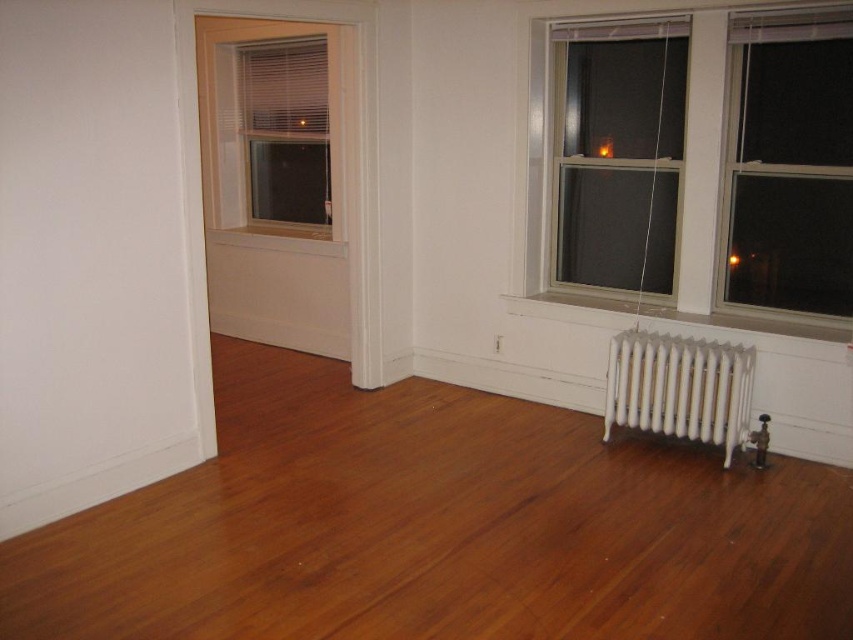
You are an interior designer planning to install a new decorative shelf between the transparent glass window at right and the transparent glass window at upper right. Since the shelf requires a certain amount of space, which window should you place it closer to based on their widths?

You should place the shelf closer to the transparent glass window at upper right because it is wider than the transparent glass window at right, providing more space for the shelf.

From the picture: You are moving a small potted plant that is 1 meter wide. You want to place it between the transparent glass window at right and the white metallic radiator at lower right. Can it fit there?

The transparent glass window at right is narrower than the white metallic radiator at lower right. Since the radiator is wider, the space between them might be sufficient, but the exact width isn answer the question. However, since the window is narrower than the radiator, the distance between them isn known. Without knowing the exact distance, we cannot determine if the 1 meter wide plant can fit. The information provided doesn specify the spacing between the window and radiator, only their relative widths

You are trying to decide which window to open for ventilation. The transparent glass window at right and the white wood window at upper left are both options. Which window is taller?

The transparent glass window at right is much taller than the white wood window at upper left, so you should choose the transparent glass window at right for better ventilation.